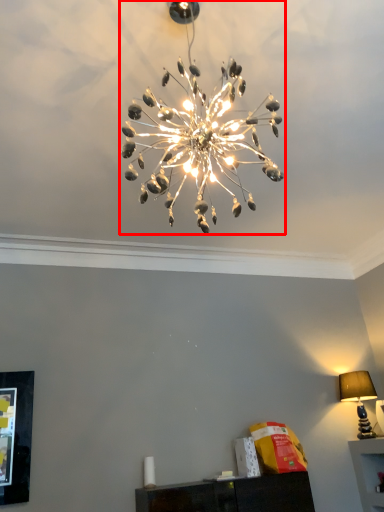
Question: From the image's perspective, where is lamp (annotated by the red box) located relative to lamp?

Choices:
 (A) below
 (B) above

Answer: (B)